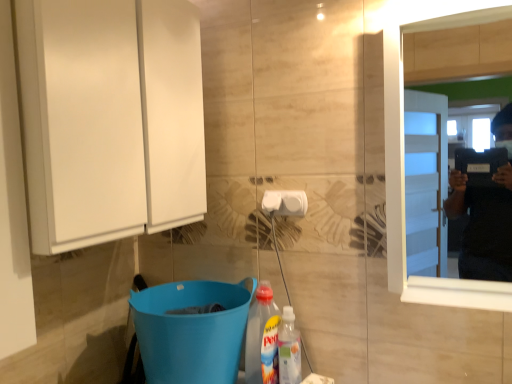
Question: Are white plastic towel bar at center and white wooden mirror at right beside each other?

Choices:
 (A) no
 (B) yes

Answer: (A)

Question: Is white plastic towel bar at center further to the viewer compared to white wooden mirror at right?

Choices:
 (A) no
 (B) yes

Answer: (B)

Question: Considering the relative sizes of white plastic towel bar at center and white wooden mirror at right in the image provided, is white plastic towel bar at center smaller than white wooden mirror at right?

Choices:
 (A) no
 (B) yes

Answer: (B)

Question: From a real-world perspective, is white plastic towel bar at center positioned over white wooden mirror at right based on gravity?

Choices:
 (A) yes
 (B) no

Answer: (B)

Question: Is white wooden mirror at right located within white plastic towel bar at center?

Choices:
 (A) no
 (B) yes

Answer: (A)

Question: Does white plastic towel bar at center lie in front of white wooden mirror at right?

Choices:
 (A) no
 (B) yes

Answer: (A)

Question: Does translucent plastic bottle at lower center have a greater height compared to white glossy cabinet at left?

Choices:
 (A) yes
 (B) no

Answer: (B)

Question: Is translucent plastic bottle at lower center oriented towards white glossy cabinet at left?

Choices:
 (A) no
 (B) yes

Answer: (A)

Question: Is white glossy cabinet at left a part of translucent plastic bottle at lower center?

Choices:
 (A) no
 (B) yes

Answer: (A)

Question: Can you confirm if translucent plastic bottle at lower center is smaller than white glossy cabinet at left?

Choices:
 (A) yes
 (B) no

Answer: (A)

Question: Is translucent plastic bottle at lower center bigger than white glossy cabinet at left?

Choices:
 (A) yes
 (B) no

Answer: (B)

Question: Does translucent plastic bottle at lower center appear on the right side of white glossy cabinet at left?

Choices:
 (A) yes
 (B) no

Answer: (A)

Question: Is white plastic towel bar at center wider than translucent plastic bottle at lower center?

Choices:
 (A) yes
 (B) no

Answer: (B)